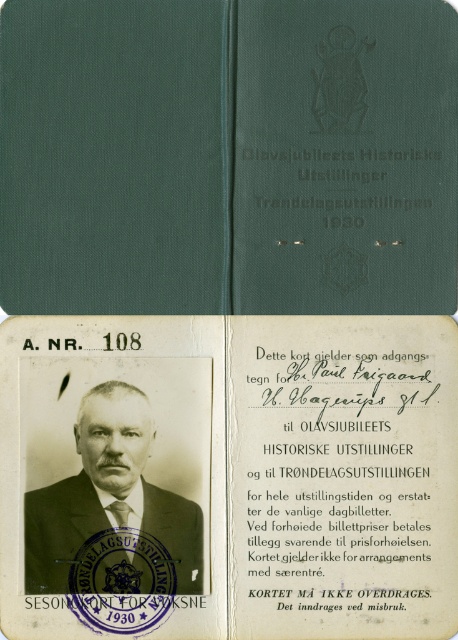
Which of these two, white paper card at center or matte black suit at center, stands taller?

Standing taller between the two is white paper card at center.

Who is shorter, white paper card at center or matte black suit at center?

Standing shorter between the two is matte black suit at center.

The height and width of the screenshot is (640, 458). What do you see at coordinates (228, 476) in the screenshot? I see `white paper card at center` at bounding box center [228, 476].

The image size is (458, 640). In order to click on white paper card at center in this screenshot , I will do `click(228, 476)`.

Looking at this image, measure the distance between white paper card at center and green fabric journal at center.

white paper card at center is 6.79 inches away from green fabric journal at center.

Between point (443, 339) and point (367, 32), which one is positioned in front?

Point (367, 32) is more forward.

Locate an element on the screen. white paper card at center is located at coordinates pos(228,476).

Who is shorter, green fabric journal at center or matte black suit at center?

With less height is matte black suit at center.

Does green fabric journal at center appear on the left side of matte black suit at center?

Incorrect, green fabric journal at center is not on the left side of matte black suit at center.

This screenshot has height=640, width=458. I want to click on green fabric journal at center, so click(x=229, y=156).

Where is `green fabric journal at center`? This screenshot has width=458, height=640. green fabric journal at center is located at coordinates (229, 156).